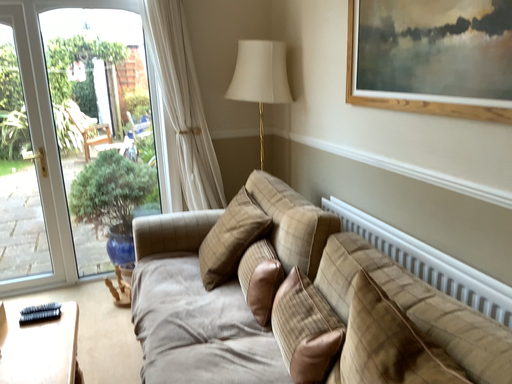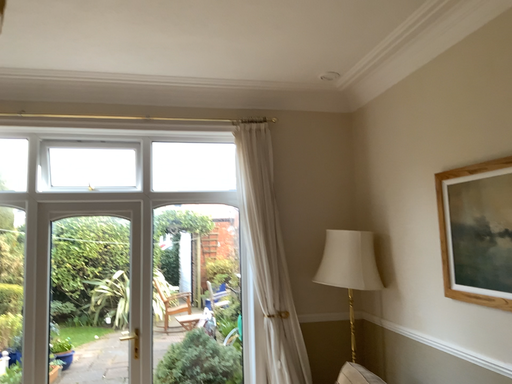
Question: How did the camera likely rotate when shooting the video?

Choices:
 (A) rotated right
 (B) rotated left

Answer: (B)